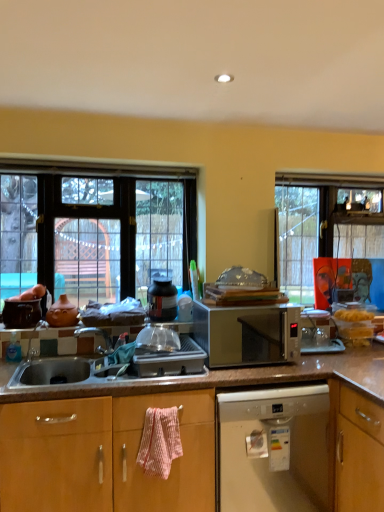
What are the coordinates of `blank space situated above pink textured towel at lower center (from a real-world perspective)` in the screenshot? It's located at (160, 407).